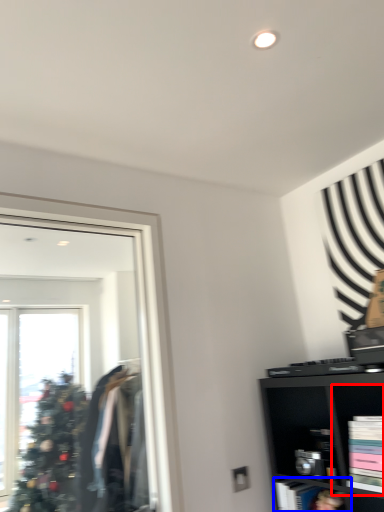
Question: Which object appears closest to the camera in this image, cabinet (highlighted by a red box) or cabinet (highlighted by a blue box)?

Choices:
 (A) cabinet
 (B) cabinet

Answer: (A)